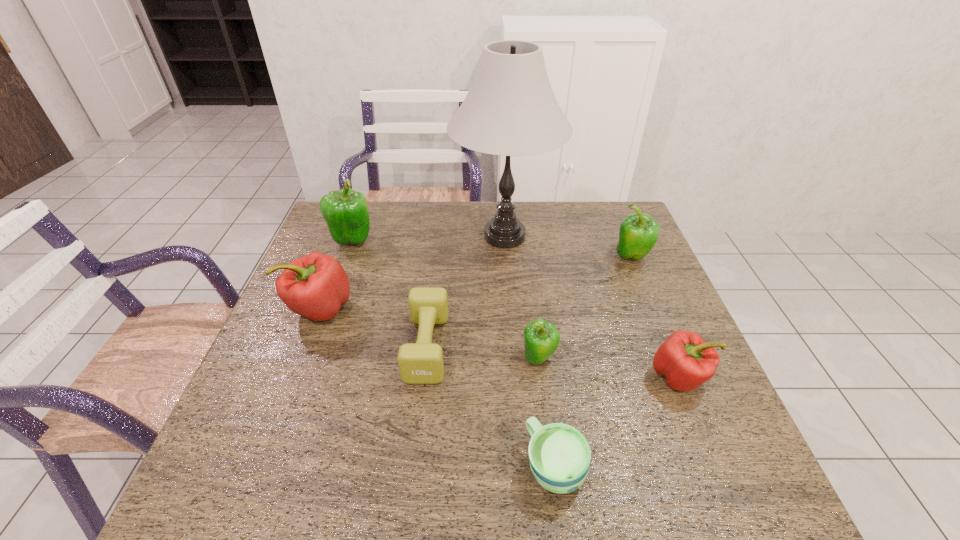
Where is `black lamp`? black lamp is located at coordinates (510, 109).

Find the location of `the tallest object`. the tallest object is located at coordinates (510, 109).

In order to click on the biggest green bell pepper in this screenshot , I will do `click(346, 212)`.

Where is `the leftmost green bell pepper`? The image size is (960, 540). the leftmost green bell pepper is located at coordinates (346, 212).

At what (x,y) coordinates should I click in order to perform the action: click on the second biggest green bell pepper. Please return your answer as a coordinate pair (x, y). The image size is (960, 540). Looking at the image, I should click on (638, 233).

Where is `the farther pink bell pepper`? the farther pink bell pepper is located at coordinates (316, 286).

The width and height of the screenshot is (960, 540). I want to click on the bigger pink bell pepper, so click(316, 286).

Find the location of a particular element. This screenshot has width=960, height=540. the second green bell pepper from left to right is located at coordinates (541, 339).

At what (x,y) coordinates should I click in order to perform the action: click on the smallest green bell pepper. Please return your answer as a coordinate pair (x, y). Looking at the image, I should click on (541, 339).

Locate an element on the screen. the right pink bell pepper is located at coordinates (686, 361).